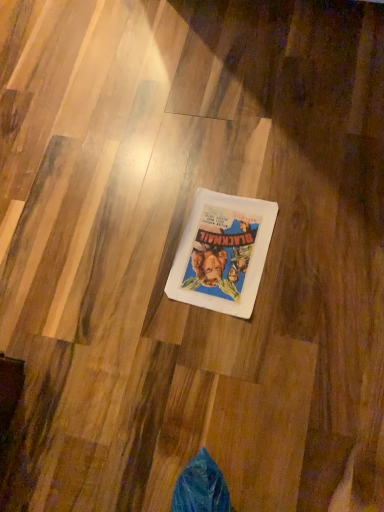
The width and height of the screenshot is (384, 512). I want to click on free space to the left of white matte book cover at center, so click(x=122, y=276).